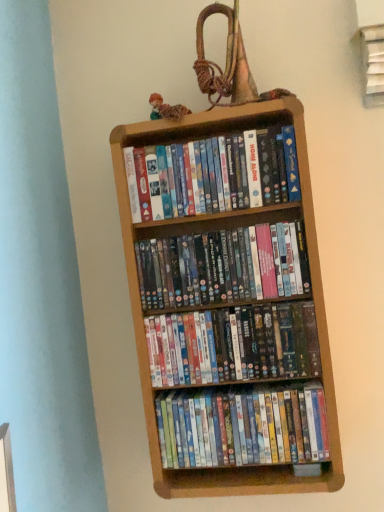
Question: Is multicolored plastic dvds at center, which is counted as the 2th book, starting from the top, spatially inside matte plastic dvds at center, positioned as the 2th book in bottom-to-top order, or outside of it?

Choices:
 (A) outside
 (B) inside

Answer: (A)

Question: Does point (306, 253) appear closer or farther from the camera than point (309, 326)?

Choices:
 (A) farther
 (B) closer

Answer: (B)

Question: Which of these objects is positioned farthest from the wooden bookcase at center?

Choices:
 (A) matte plastic dvds at upper center, the first book when ordered from top to bottom
 (B) matte plastic dvds at center, positioned as the 2th book in bottom-to-top order
 (C) multicolored plastic dvds at center, the 3th book when ordered from bottom to top
 (D) matte plastic dvds at center, which is the 4th book from top to bottom
 (E) multicolored fabric doll at upper center

Answer: (E)

Question: Based on their relative distances, which object is farther from the matte plastic dvds at upper center, the 4th book in the bottom-to-top sequence?

Choices:
 (A) multicolored plastic dvds at center, the 3th book when ordered from bottom to top
 (B) wooden bookcase at center
 (C) matte plastic dvds at center, which is the 4th book from top to bottom
 (D) multicolored fabric doll at upper center
 (E) matte plastic dvds at center, positioned as the 2th book in bottom-to-top order

Answer: (C)